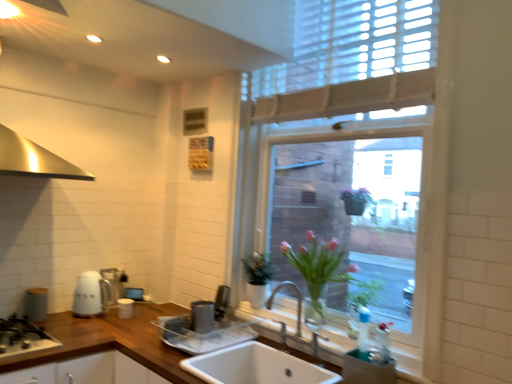
Question: From a real-world perspective, is satin silver toaster at lower center, acting as the second appliance starting from the front, on top of black matte gas stove at lower left?

Choices:
 (A) yes
 (B) no

Answer: (A)

Question: Does satin silver toaster at lower center, placed as the fourth appliance when sorted from left to right, have a smaller size compared to black matte gas stove at lower left?

Choices:
 (A) no
 (B) yes

Answer: (B)

Question: Is satin silver toaster at lower center, placed as the fourth appliance when sorted from left to right, further to the viewer compared to black matte gas stove at lower left?

Choices:
 (A) yes
 (B) no

Answer: (A)

Question: From the image's perspective, does satin silver toaster at lower center, acting as the second appliance starting from the front, appear lower than black matte gas stove at lower left?

Choices:
 (A) yes
 (B) no

Answer: (B)

Question: Can you confirm if satin silver toaster at lower center, arranged as the second appliance when viewed from the right, is taller than black matte gas stove at lower left?

Choices:
 (A) no
 (B) yes

Answer: (B)

Question: Considering the relative positions of white ceramic sink at lower center and metallic silver dish drainer at lower right, which is the first appliance in right-to-left order, in the image provided, is white ceramic sink at lower center to the left or to the right of metallic silver dish drainer at lower right, which is the first appliance in right-to-left order,?

Choices:
 (A) left
 (B) right

Answer: (A)

Question: Does point (337, 329) appear closer or farther from the camera than point (370, 382)?

Choices:
 (A) farther
 (B) closer

Answer: (A)

Question: Is white ceramic sink at lower center in front of or behind metallic silver dish drainer at lower right, which is the first appliance in right-to-left order, in the image?

Choices:
 (A) front
 (B) behind

Answer: (A)

Question: From the image's perspective, relative to metallic silver dish drainer at lower right, the 5th appliance when ordered from back to front, is white ceramic sink at lower center above or below?

Choices:
 (A) above
 (B) below

Answer: (B)

Question: Based on their sizes in the image, would you say white ceramic sink at center is bigger or smaller than wooden at center?

Choices:
 (A) big
 (B) small

Answer: (B)

Question: Is white ceramic sink at center wider or thinner than wooden at center?

Choices:
 (A) thin
 (B) wide

Answer: (A)

Question: Would you say white ceramic sink at center is inside or outside wooden at center?

Choices:
 (A) inside
 (B) outside

Answer: (A)

Question: From the image's perspective, relative to wooden at center, is white ceramic sink at center above or below?

Choices:
 (A) below
 (B) above

Answer: (B)

Question: Visually, is matte gray canister at left, the third appliance positioned from the back, positioned to the left or to the right of transparent glass window at center?

Choices:
 (A) left
 (B) right

Answer: (A)

Question: Relative to transparent glass window at center, is matte gray canister at left, placed as the fifth appliance when sorted from right to left, in front or behind?

Choices:
 (A) behind
 (B) front

Answer: (A)